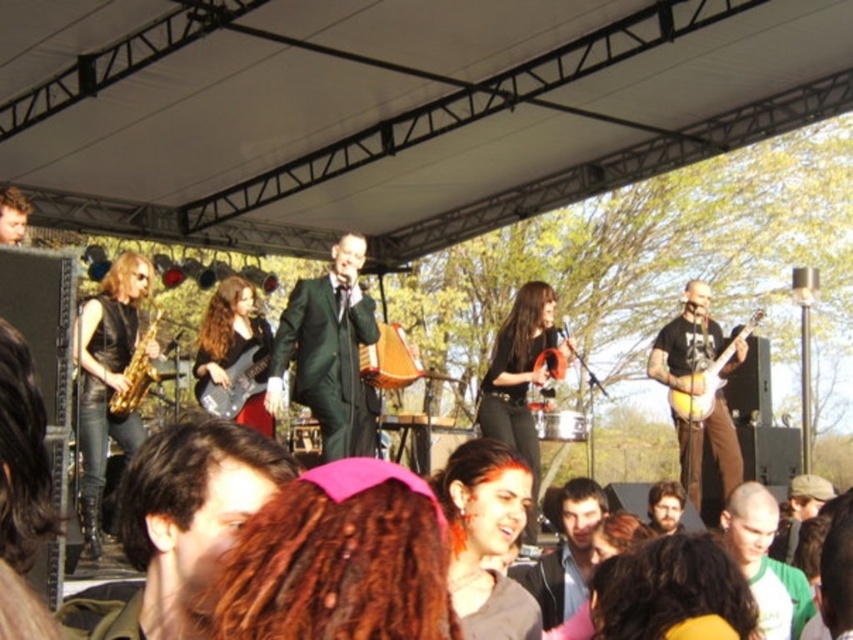
Question: Does shiny black suit at center appear under smooth brown hair at center?

Choices:
 (A) yes
 (B) no

Answer: (B)

Question: Does wooden string instrument at center come in front of wooden acoustic guitar at center?

Choices:
 (A) no
 (B) yes

Answer: (A)

Question: Among these objects, which one is farthest from the camera?

Choices:
 (A) yellow electric guitar at right
 (B) matte black electric guitar at center
 (C) bald head at center

Answer: (A)

Question: Among these points, which one is farthest from the camera?

Choices:
 (A) (508, 515)
 (B) (746, 524)
 (C) (146, 333)

Answer: (C)

Question: Based on their relative distances, which object is farther from the matte pink hoodie at center?

Choices:
 (A) matte black electric guitar at center
 (B) yellow electric guitar at right
 (C) wooden string instrument at center

Answer: (B)

Question: Can you confirm if shiny black suit at center is bigger than matte black electric guitar at center?

Choices:
 (A) yes
 (B) no

Answer: (A)